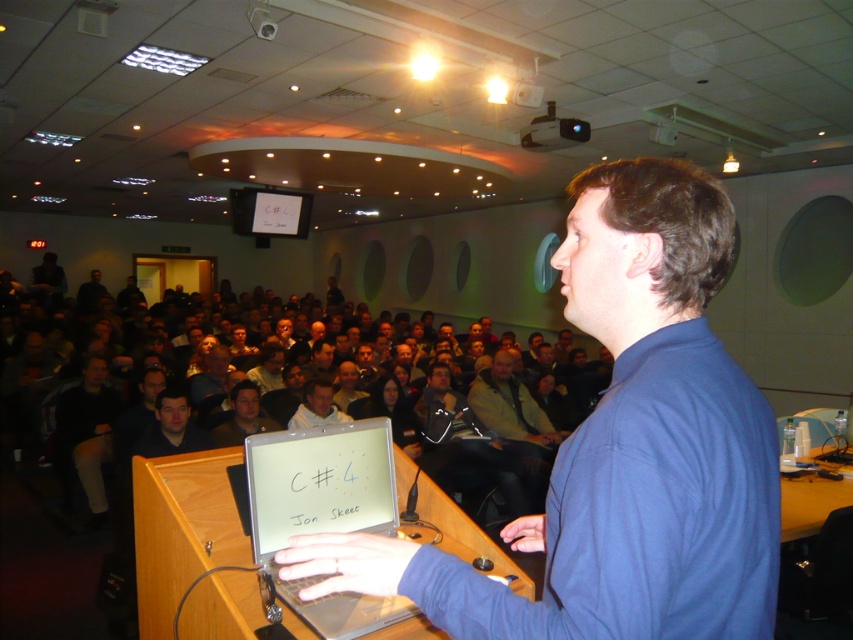
Question: Considering the relative positions of black plastic projector at upper center and white matte shirt at center in the image provided, where is black plastic projector at upper center located with respect to white matte shirt at center?

Choices:
 (A) left
 (B) right

Answer: (B)

Question: Which of the following is the farthest from the observer?

Choices:
 (A) (537, 136)
 (B) (231, 404)

Answer: (A)

Question: Is dark gray fabric crowd at center smaller than dark brown hair at center?

Choices:
 (A) yes
 (B) no

Answer: (B)

Question: Among these objects, which one is nearest to the camera?

Choices:
 (A) silver metallic laptop at center
 (B) black plastic projector at upper center
 (C) white matte shirt at center
 (D) blue fabric shirt at center

Answer: (D)

Question: Considering the relative positions of dark brown hair at center and black plastic projector at upper center in the image provided, where is dark brown hair at center located with respect to black plastic projector at upper center?

Choices:
 (A) left
 (B) right

Answer: (A)

Question: Which object is closer to the camera taking this photo?

Choices:
 (A) black plastic projector at upper center
 (B) blue fabric shirt at center

Answer: (B)